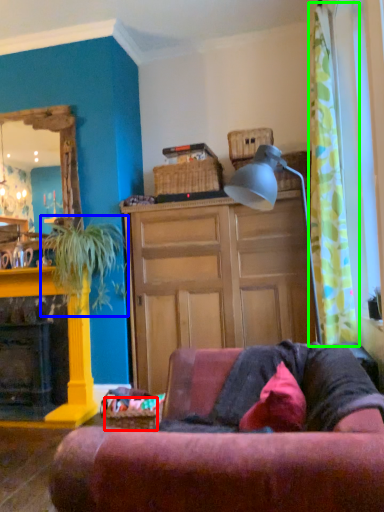
Question: Which is nearer to the picnic basket (highlighted by a red box)? houseplant (highlighted by a blue box) or curtain (highlighted by a green box).

Choices:
 (A) houseplant
 (B) curtain

Answer: (A)